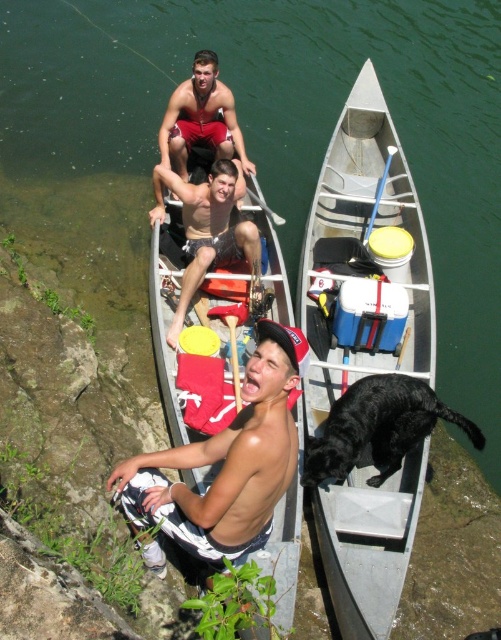
Does shiny white shorts at center appear on the left side of wooden paddle at center?

Correct, you'll find shiny white shorts at center to the left of wooden paddle at center.

Can you confirm if shiny white shorts at center is smaller than wooden paddle at center?

No.

The image size is (501, 640). Identify the location of shiny white shorts at center. (225, 464).

Is matte red canoe at center bigger than matte red shorts at upper center?

Indeed, matte red canoe at center has a larger size compared to matte red shorts at upper center.

Is matte red canoe at center in front of matte red shorts at upper center?

Yes, it is in front of matte red shorts at upper center.

Locate an element on the screen. This screenshot has height=640, width=501. matte red canoe at center is located at coordinates (202, 291).

Based on the photo, is white plastic boat at center closer to camera compared to yellow foam paddle at center?

Yes.

Does white plastic boat at center have a smaller size compared to yellow foam paddle at center?

No, white plastic boat at center is not smaller than yellow foam paddle at center.

Describe the element at coordinates (365, 248) in the screenshot. Image resolution: width=501 pixels, height=640 pixels. I see `white plastic boat at center` at that location.

The image size is (501, 640). I want to click on white plastic boat at center, so click(365, 248).